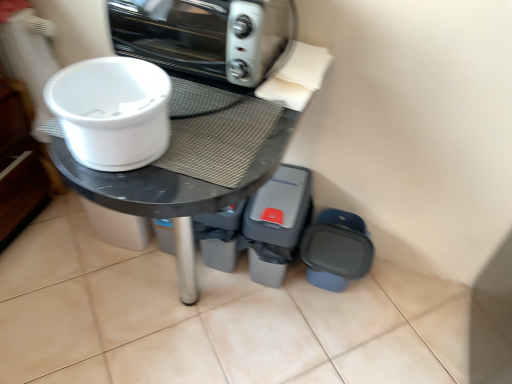
Question: From a real-world perspective, is metallic silver toaster oven at upper center on top of matte plastic container at lower right, the second appliance viewed from the left?

Choices:
 (A) no
 (B) yes

Answer: (B)

Question: Are metallic silver toaster oven at upper center and matte plastic container at lower right, the first appliance from the right, far apart?

Choices:
 (A) no
 (B) yes

Answer: (A)

Question: Is metallic silver toaster oven at upper center closer to the viewer compared to matte plastic container at lower right, the first appliance from the right?

Choices:
 (A) no
 (B) yes

Answer: (B)

Question: From a real-world perspective, does metallic silver toaster oven at upper center sit lower than matte plastic container at lower right, the first appliance from the right?

Choices:
 (A) no
 (B) yes

Answer: (A)

Question: Is metallic silver toaster oven at upper center placed right next to matte plastic container at lower right, the first appliance from the right?

Choices:
 (A) no
 (B) yes

Answer: (A)

Question: From the image's perspective, is metallic silver toaster oven at upper center located above or below gray plastic bin at lower right, which appears as the first appliance when viewed from the left?

Choices:
 (A) below
 (B) above

Answer: (B)

Question: Choose the correct answer: Is metallic silver toaster oven at upper center inside gray plastic bin at lower right, which appears as the first appliance when viewed from the left, or outside it?

Choices:
 (A) inside
 (B) outside

Answer: (B)

Question: Considering the positions of metallic silver toaster oven at upper center and gray plastic bin at lower right, which appears as the first appliance when viewed from the left, in the image, is metallic silver toaster oven at upper center wider or thinner than gray plastic bin at lower right, which appears as the first appliance when viewed from the left,?

Choices:
 (A) wide
 (B) thin

Answer: (B)

Question: Relative to gray plastic bin at lower right, which appears as the first appliance when viewed from the left, is metallic silver toaster oven at upper center in front or behind?

Choices:
 (A) front
 (B) behind

Answer: (A)

Question: Considering the positions of matte plastic container at lower right, the second appliance viewed from the left, and white plastic bowl at upper left in the image, is matte plastic container at lower right, the second appliance viewed from the left, bigger or smaller than white plastic bowl at upper left?

Choices:
 (A) big
 (B) small

Answer: (A)

Question: Would you say matte plastic container at lower right, the first appliance from the right, is inside or outside white plastic bowl at upper left?

Choices:
 (A) outside
 (B) inside

Answer: (A)

Question: Considering their positions, is matte plastic container at lower right, the second appliance viewed from the left, located in front of or behind white plastic bowl at upper left?

Choices:
 (A) behind
 (B) front

Answer: (A)

Question: Would you say matte plastic container at lower right, the second appliance viewed from the left, is to the left or to the right of white plastic bowl at upper left in the picture?

Choices:
 (A) left
 (B) right

Answer: (B)

Question: Considering the positions of matte black table at center and gray plastic bin at lower right, the second appliance viewed from the right, in the image, is matte black table at center taller or shorter than gray plastic bin at lower right, the second appliance viewed from the right,?

Choices:
 (A) short
 (B) tall

Answer: (B)

Question: Is matte black table at center in front of or behind gray plastic bin at lower right, the second appliance viewed from the right, in the image?

Choices:
 (A) behind
 (B) front

Answer: (B)